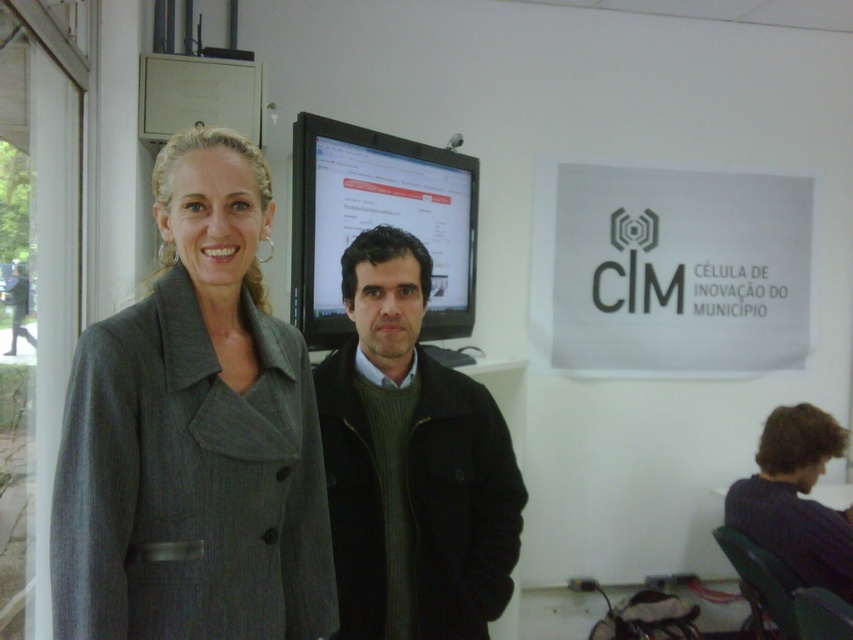
You are organizing a clothing donation drive and need to determine which of the two items, the gray woolen coat at center or the dark green sweater at center, can fit into a standard donation box that requires items to be no larger than 12 inches in width. According to the scene description, which item is more likely to fit?

The gray woolen coat at center has a smaller size compared to the dark green sweater at center. Since the donation box requires items to be no larger than 12 inches in width, the gray woolen coat at center is more likely to fit.

Looking at this image, you are a photographer holding a camera. You want to take a photo of the gray woolen coat at center without moving the coat. Can you do it from your current position?

Yes, the gray woolen coat at center and camera are 3.55 feet apart, so you can take the photo from your current position.

You are setting up a photo shoot in this room and need to position a light source between the dark green sweater at center and the matte black monitor at center. The light source has a maximum coverage radius of 15 inches. Will the light effectively illuminate both objects?

The dark green sweater at center and matte black monitor at center are 31.81 inches apart. Since the light source has a maximum coverage radius of 15 inches, the distance between them is greater than twice the radius. Therefore, the light source cannot effectively illuminate both objects simultaneously.